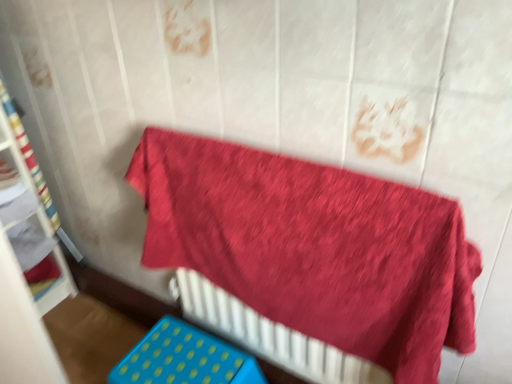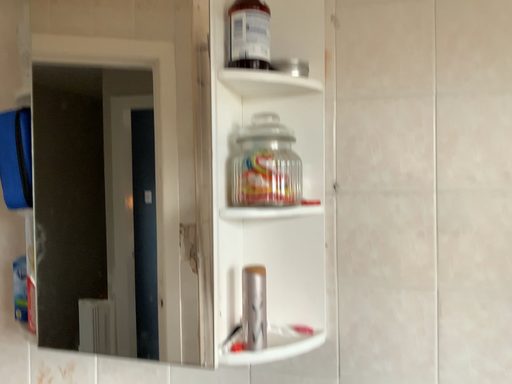
Question: How did the camera likely rotate when shooting the video?

Choices:
 (A) rotated left
 (B) rotated right

Answer: (B)